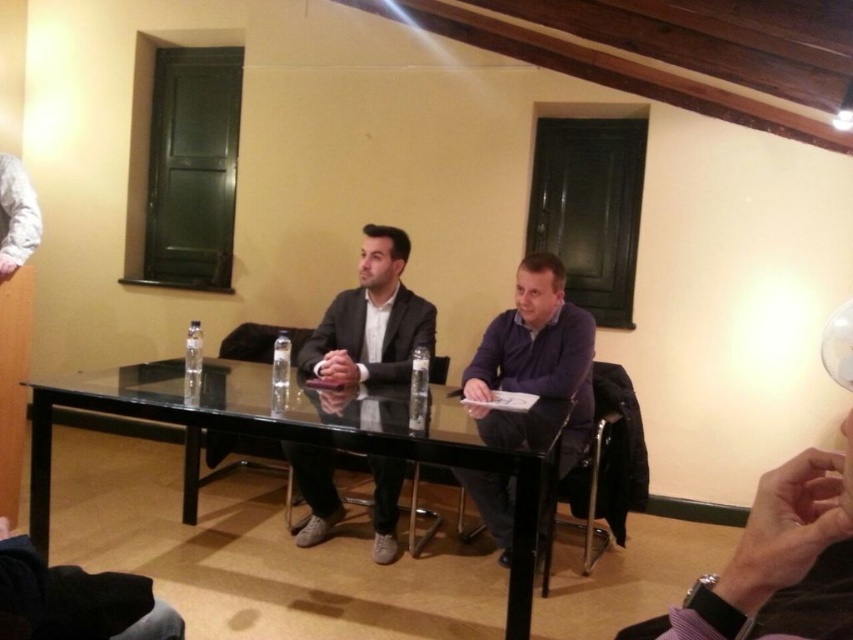
In the scene shown: Does transparent glass table at center have a lesser height compared to purple matte shirt at center?

Yes.

Which is above, transparent glass table at center or purple matte shirt at center?

purple matte shirt at center is higher up.

This screenshot has width=853, height=640. What are the coordinates of `transparent glass table at center` in the screenshot? It's located at (322, 436).

Image resolution: width=853 pixels, height=640 pixels. What are the coordinates of `transparent glass table at center` in the screenshot? It's located at (322, 436).

Is point (399, 401) in front of point (399, 304)?

Yes, it is.

Can you confirm if transparent glass table at center is positioned to the left of matte black suit at center?

Correct, you'll find transparent glass table at center to the left of matte black suit at center.

Which is behind, point (376, 451) or point (430, 310)?

The point (430, 310) is behind.

At what (x,y) coordinates should I click in order to perform the action: click on transparent glass table at center. Please return your answer as a coordinate pair (x, y). The height and width of the screenshot is (640, 853). Looking at the image, I should click on (322, 436).

Does matte black suit at center appear under purple matte shirt at center?

No, matte black suit at center is not below purple matte shirt at center.

Who is more forward, (379, 234) or (474, 392)?

Point (474, 392) is more forward.

Where is `matte black suit at center`? matte black suit at center is located at coordinates (370, 321).